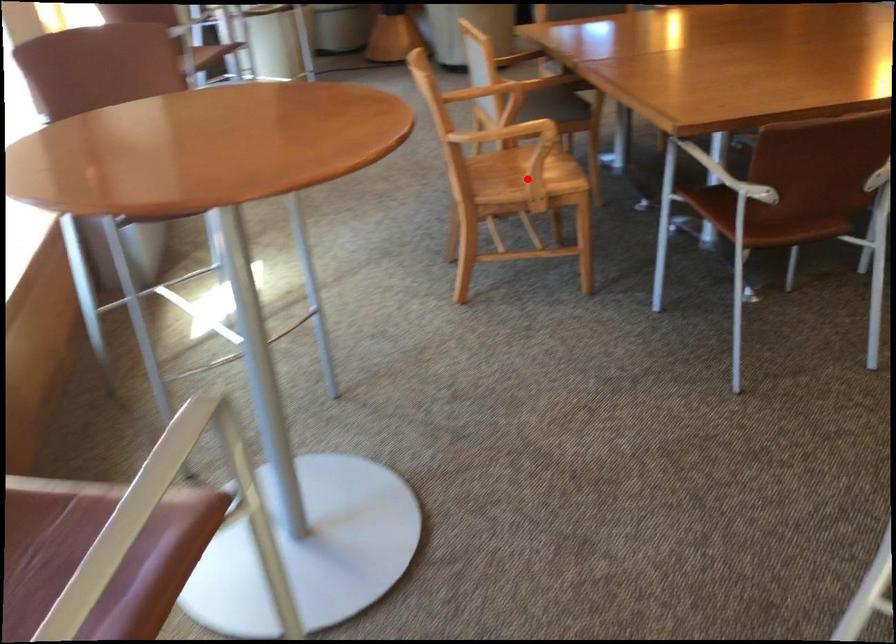
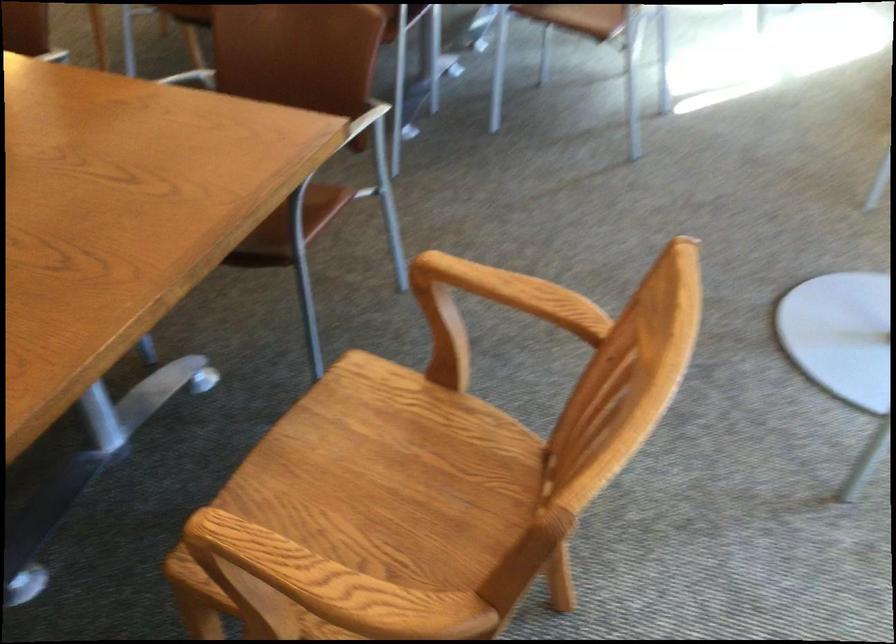
Question: I am providing you with two images of the same scene from different viewpoints. A red point is marked on the first image. Can you still see the location of the red point in image 2?

Choices:
 (A) Yes
 (B) No

Answer: (B)